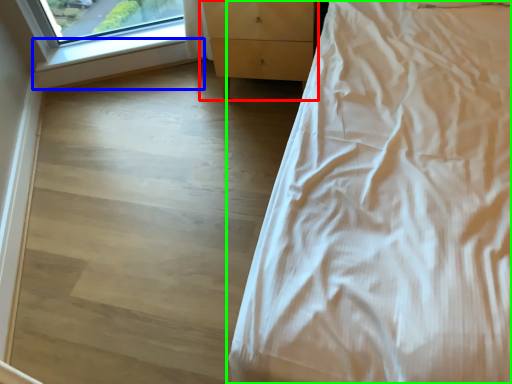
Question: Estimate the real-world distances between objects in this image. Which object is closer to chest of drawers (highlighted by a red box), window sill (highlighted by a blue box) or bed (highlighted by a green box)?

Choices:
 (A) window sill
 (B) bed

Answer: (A)